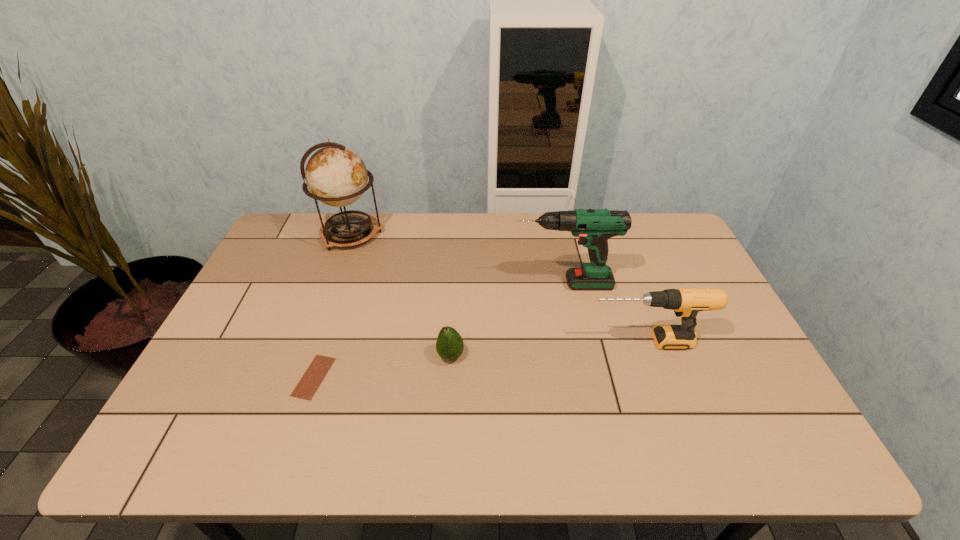
The width and height of the screenshot is (960, 540). What are the coordinates of `vacant space that satisfies the following two spatial constraints: 1. at the center of the second shortest object; 2. on the left side of the farthest object` in the screenshot? It's located at (307, 356).

Where is `vacant area in the image that satisfies the following two spatial constraints: 1. on the back side of the shortest object; 2. at the center of the globe`? This screenshot has width=960, height=540. vacant area in the image that satisfies the following two spatial constraints: 1. on the back side of the shortest object; 2. at the center of the globe is located at coordinates (361, 234).

Locate an element on the screen. The width and height of the screenshot is (960, 540). vacant space that satisfies the following two spatial constraints: 1. at the center of the globe; 2. on the right side of the second shortest object is located at coordinates coord(307,356).

The width and height of the screenshot is (960, 540). I want to click on free space in the image that satisfies the following two spatial constraints: 1. on the handle side of the farther drill; 2. on the front side of the shortest object, so click(x=581, y=377).